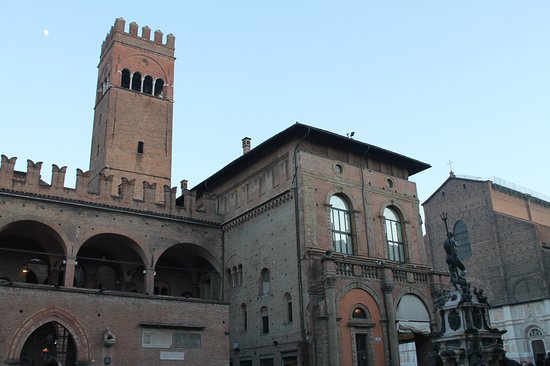
Where is `statue`? statue is located at coordinates (450, 253).